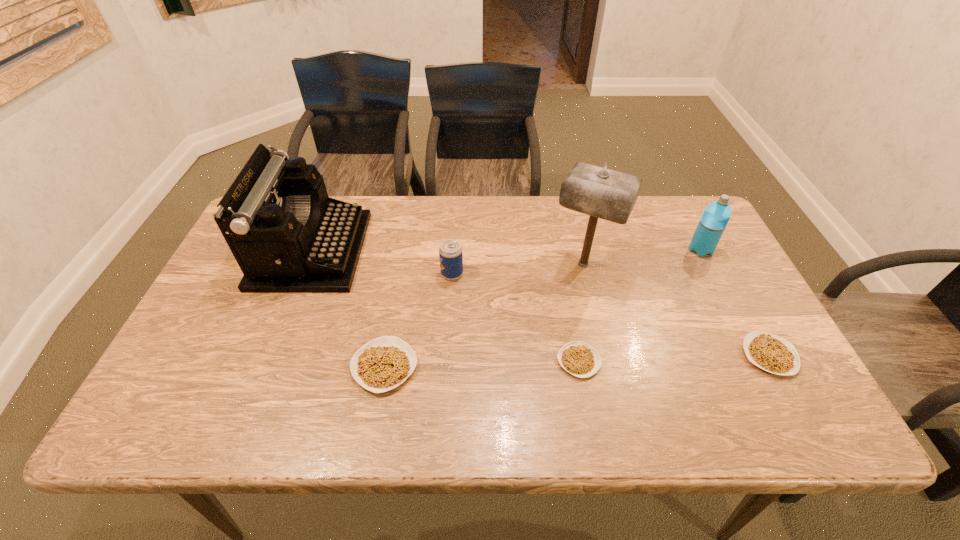
Find the location of `the tallest legume`. the tallest legume is located at coordinates (384, 363).

Where is `the third shortest object`? The width and height of the screenshot is (960, 540). the third shortest object is located at coordinates (384, 363).

Locate an element on the screen. the second legume from left to right is located at coordinates (578, 358).

Find the location of a particular element. The width and height of the screenshot is (960, 540). the shortest object is located at coordinates (578, 358).

Locate an element on the screen. This screenshot has height=540, width=960. the rightmost legume is located at coordinates (769, 352).

The image size is (960, 540). I want to click on the second shortest object, so click(x=769, y=352).

Where is `mallet`? This screenshot has width=960, height=540. mallet is located at coordinates (599, 192).

Find the location of a particular element. typewriter is located at coordinates (287, 235).

You are a GUI agent. You are given a task and a screenshot of the screen. Output one action in this format:
    pyautogui.click(x=<x>, y=<y>)
    Task: Click on the leftmost object
    
    Given the screenshot: What is the action you would take?
    pyautogui.click(x=287, y=235)

The height and width of the screenshot is (540, 960). In order to click on the third tallest object in this screenshot , I will do `click(716, 215)`.